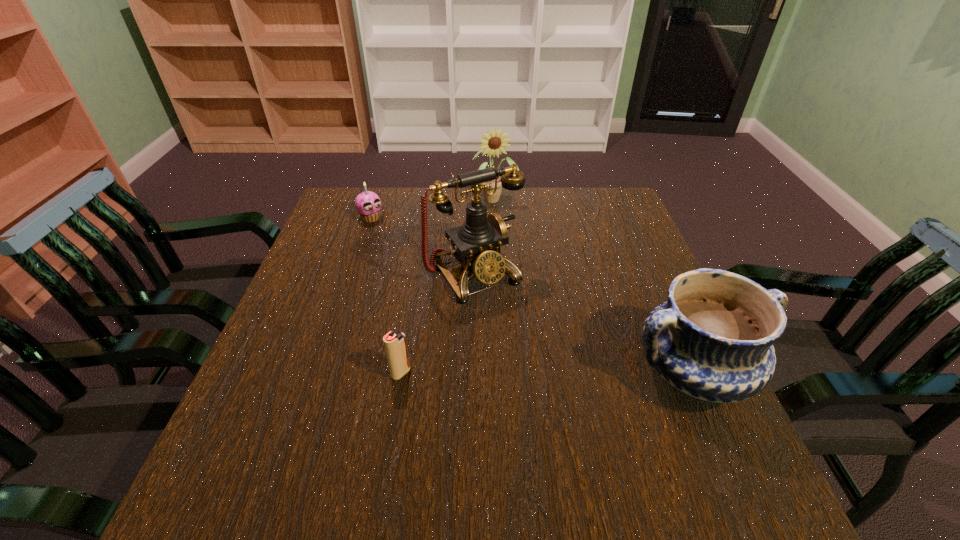
This screenshot has width=960, height=540. I want to click on cupcake that is at the far edge, so click(368, 204).

The width and height of the screenshot is (960, 540). I want to click on sunflower located in the far edge section of the desktop, so click(495, 143).

This screenshot has height=540, width=960. Identify the location of object that is at the near edge. (713, 339).

The image size is (960, 540). I want to click on object that is at the left edge, so click(368, 204).

In order to click on object at the right edge in this screenshot , I will do `click(713, 339)`.

The width and height of the screenshot is (960, 540). Identify the location of object located at the far left corner. point(368,204).

At what (x,y) coordinates should I click in order to perform the action: click on object located in the near right corner section of the desktop. Please return your answer as a coordinate pair (x, y). Looking at the image, I should click on (713, 339).

Image resolution: width=960 pixels, height=540 pixels. Identify the location of vacant space at the far edge of the desktop. (573, 206).

Identify the location of vacant space at the near edge. The image size is (960, 540). (459, 447).

At what (x,y) coordinates should I click in order to perform the action: click on vacant space at the left edge of the desktop. Please return your answer as a coordinate pair (x, y). Looking at the image, I should click on (311, 335).